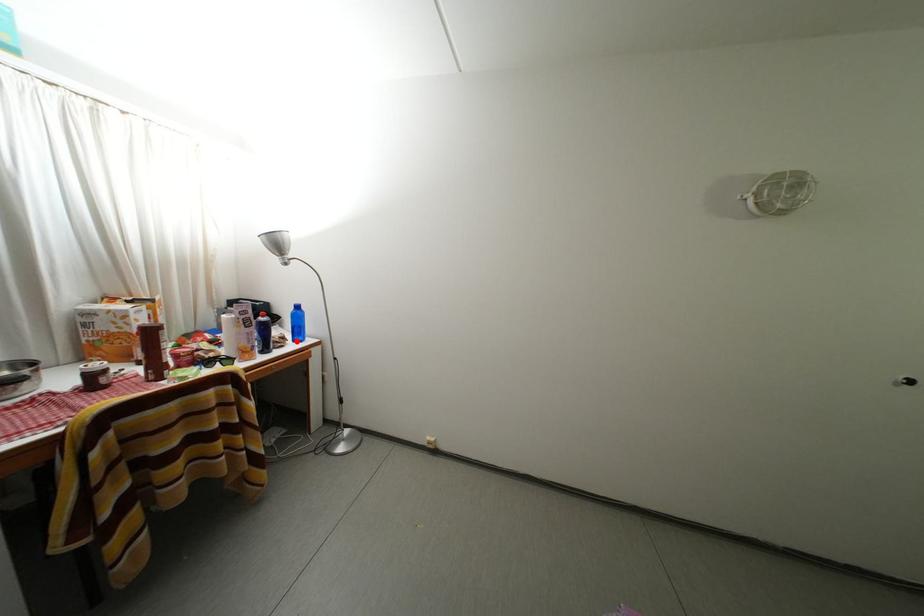
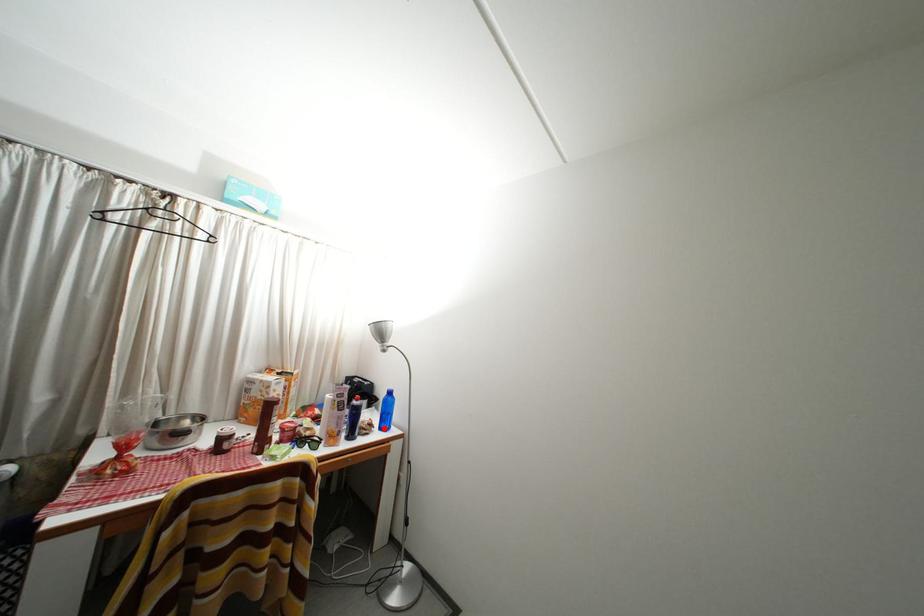
I am providing you with two images of the same scene from different viewpoints. A red point is marked on the first image and another point is marked on the second image. Do the highlighted points in image1 and image2 indicate the same real-world spot?

Yes